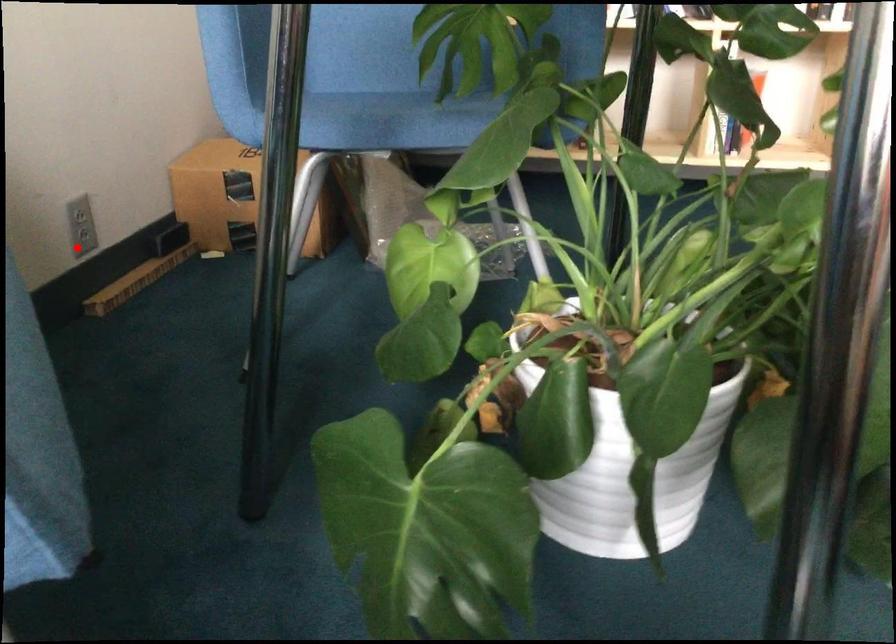
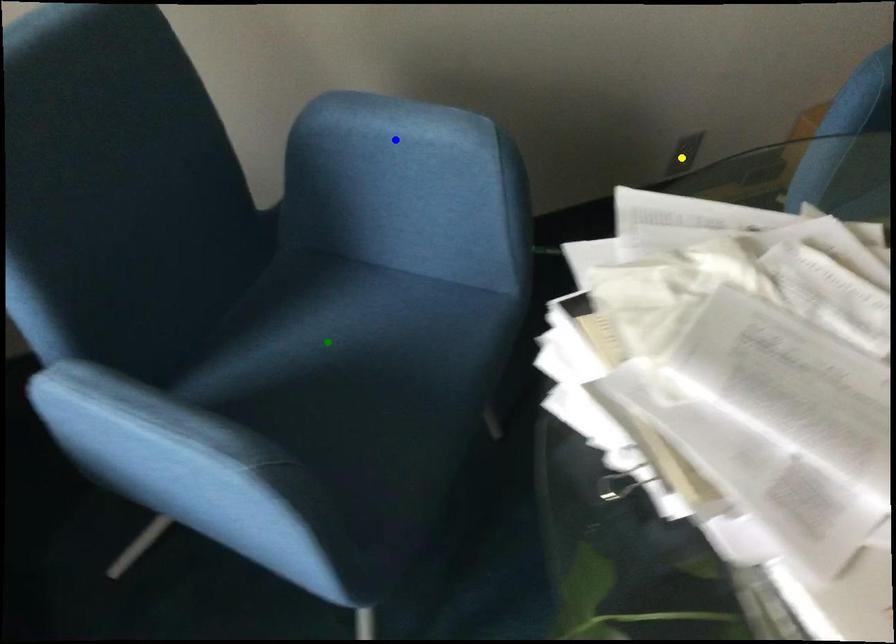
Question: I am providing you with two images of the same scene from different viewpoints. A red point is marked on the first image. You are given multiple points on the second image. In image 2, which mark is for the same physical point as the one in image 1?

Choices:
 (A) blue point
 (B) green point
 (C) yellow point

Answer: (C)